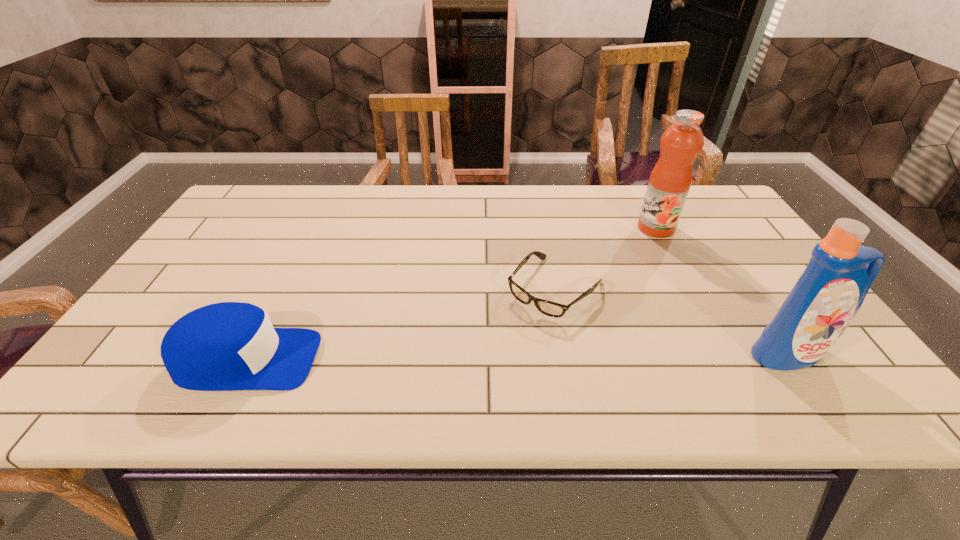
Where is `free space located on the front label of the fruit juice`? This screenshot has height=540, width=960. free space located on the front label of the fruit juice is located at coordinates (636, 249).

In order to click on vacant area located on the front-facing side of the spectacles in this screenshot , I will do `click(483, 366)`.

Where is `free space located 0.070m on the front-facing side of the spectacles`? free space located 0.070m on the front-facing side of the spectacles is located at coordinates (512, 334).

Identify the location of object present at the far edge. (671, 178).

This screenshot has height=540, width=960. What are the coordinates of `baseball cap located at the near edge` in the screenshot? It's located at (226, 346).

Locate an element on the screen. This screenshot has height=540, width=960. detergent situated at the near edge is located at coordinates (827, 296).

Where is `object present at the left edge`? The height and width of the screenshot is (540, 960). object present at the left edge is located at coordinates (226, 346).

You are a GUI agent. You are given a task and a screenshot of the screen. Output one action in this format:
    pyautogui.click(x=<x>, y=<y>)
    Task: Click on the object that is at the right edge
    This screenshot has height=540, width=960.
    Given the screenshot: What is the action you would take?
    pyautogui.click(x=827, y=296)

You are a GUI agent. You are given a task and a screenshot of the screen. Output one action in this format:
    pyautogui.click(x=<x>, y=<y>)
    Task: Click on the object present at the near left corner
    
    Given the screenshot: What is the action you would take?
    pyautogui.click(x=226, y=346)

The width and height of the screenshot is (960, 540). In order to click on object that is at the near right corner in this screenshot , I will do `click(827, 296)`.